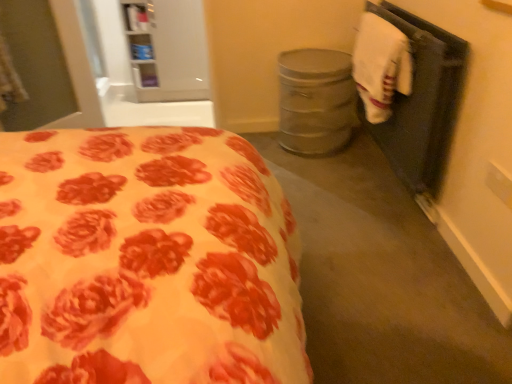
What do you see at coordinates (423, 102) in the screenshot? I see `white fabric at right` at bounding box center [423, 102].

The height and width of the screenshot is (384, 512). I want to click on white fabric at right, so click(423, 102).

The width and height of the screenshot is (512, 384). What do you see at coordinates (380, 66) in the screenshot?
I see `white cotton hand towel at right` at bounding box center [380, 66].

Based on the photo, measure the distance between white cotton hand towel at right and camera.

The depth of white cotton hand towel at right is 1.73 meters.

Locate an element on the screen. Image resolution: width=512 pixels, height=384 pixels. white cotton hand towel at right is located at coordinates (380, 66).

Where is `white fabric at right`? The image size is (512, 384). white fabric at right is located at coordinates (423, 102).

Based on their positions, is white cotton hand towel at right located to the left or right of white fabric at right?

Based on their positions, white cotton hand towel at right is located to the left of white fabric at right.

Is white cotton hand towel at right behind white fabric at right?

Yes.

Which is closer, (386, 98) or (414, 19)?

Point (386, 98) appears to be closer to the viewer than point (414, 19).

From the image's perspective, is white cotton hand towel at right beneath white fabric at right?

No, from the image's perspective, white cotton hand towel at right is not beneath white fabric at right.

From a real-world perspective, which is physically above, white cotton hand towel at right or white fabric at right?

In real-world perspective, white cotton hand towel at right is above.

Based on the photo, which object is wider, white cotton hand towel at right or white fabric at right?

Wider between the two is white cotton hand towel at right.

Which of these two, white cotton hand towel at right or white fabric at right, stands shorter?

white cotton hand towel at right is shorter.

Can you confirm if white cotton hand towel at right is smaller than white fabric at right?

Indeed, white cotton hand towel at right has a smaller size compared to white fabric at right.

Is white cotton hand towel at right positioned beyond the bounds of white fabric at right?

Absolutely, white cotton hand towel at right is external to white fabric at right.

Is white cotton hand towel at right far from white fabric at right?

white cotton hand towel at right is near white fabric at right, not far away.

Is white cotton hand towel at right looking in the opposite direction of white fabric at right?

Yes, white cotton hand towel at right is facing away from white fabric at right.

What's the angular difference between white cotton hand towel at right and white fabric at right's facing directions?

There is a 0.746-degree angle between the facing directions of white cotton hand towel at right and white fabric at right.

Measure the distance between white cotton hand towel at right and white fabric at right.

They are 6.42 inches apart.

The image size is (512, 384). I want to click on closet beneath the white cotton hand towel at right (from a real-world perspective), so click(x=423, y=102).

Considering the positions of objects white fabric at right and white cotton hand towel at right in the image provided, who is more to the left, white fabric at right or white cotton hand towel at right?

Positioned to the left is white cotton hand towel at right.

Which is in front, white fabric at right or white cotton hand towel at right?

white fabric at right is in front.

Considering the positions of point (414, 47) and point (366, 59), is point (414, 47) closer or farther from the camera than point (366, 59)?

Point (414, 47) appears to be closer to the viewer than point (366, 59).

From the image's perspective, which is above, white fabric at right or white cotton hand towel at right?

white cotton hand towel at right.

From a real-world perspective, between white fabric at right and white cotton hand towel at right, who is vertically lower?

white fabric at right, from a real-world perspective.

Considering the relative sizes of white fabric at right and white cotton hand towel at right in the image provided, is white fabric at right wider than white cotton hand towel at right?

No, white fabric at right is not wider than white cotton hand towel at right.

Is white fabric at right taller than white cotton hand towel at right?

Correct, white fabric at right is much taller as white cotton hand towel at right.

Based on their sizes in the image, would you say white fabric at right is bigger or smaller than white cotton hand towel at right?

In the image, white fabric at right appears to be larger than white cotton hand towel at right.

Is white cotton hand towel at right inside white fabric at right?

No, white cotton hand towel at right is not inside white fabric at right.

Are white fabric at right and white cotton hand towel at right far apart?

No, there isn't a large distance between white fabric at right and white cotton hand towel at right.

Is white fabric at right oriented towards white cotton hand towel at right?

Yes.

How much distance is there between white fabric at right and white cotton hand towel at right?

white fabric at right and white cotton hand towel at right are 6.42 inches apart.

Where is `closet below the white cotton hand towel at right (from a real-world perspective)`? The width and height of the screenshot is (512, 384). closet below the white cotton hand towel at right (from a real-world perspective) is located at coordinates (423, 102).

In order to click on closet below the white cotton hand towel at right (from the image's perspective) in this screenshot , I will do `click(423, 102)`.

Where is `hand towel above the white fabric at right (from a real-world perspective)`? The image size is (512, 384). hand towel above the white fabric at right (from a real-world perspective) is located at coordinates tap(380, 66).